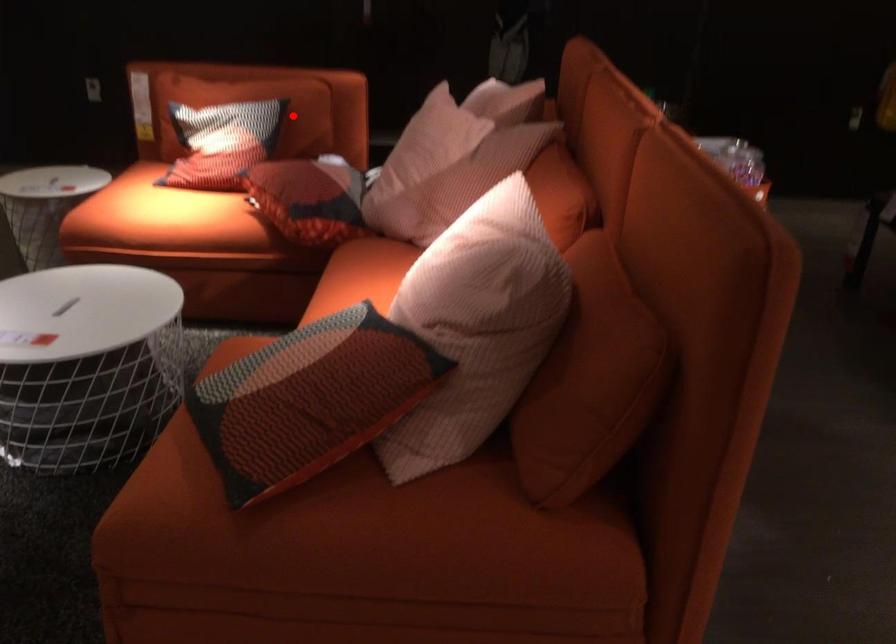
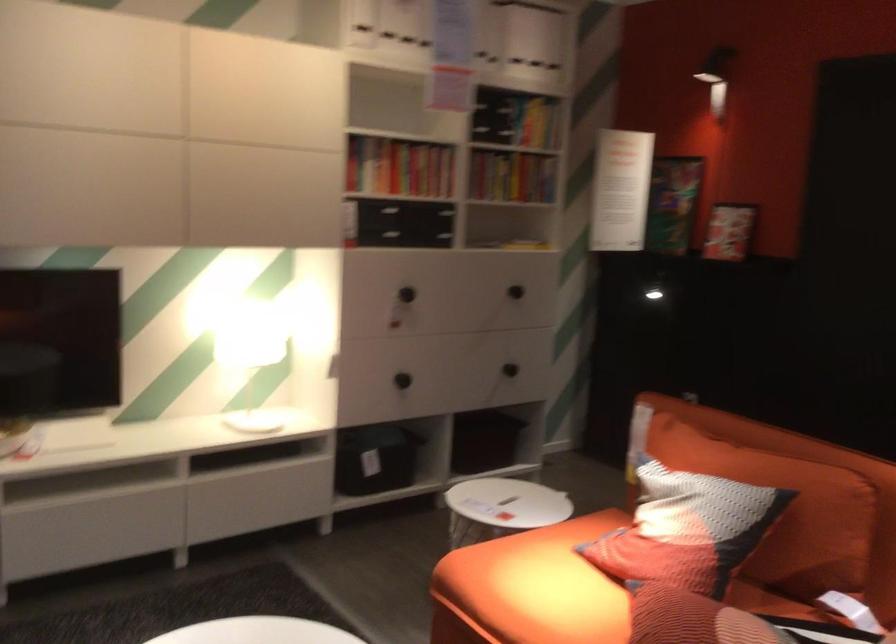
Question: I am providing you with two images of the same scene from different viewpoints. A red point is marked on the first image. Is the red point's position out of view in image 2?

Choices:
 (A) Yes
 (B) No

Answer: (B)